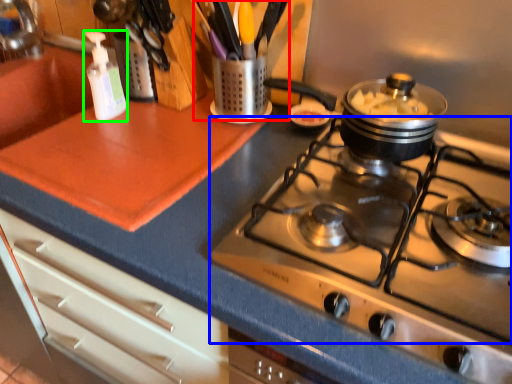
Question: Estimate the real-world distances between objects in this image. Which object is farther from appliance (highlighted by a red box), gas stove (highlighted by a blue box) or bottle (highlighted by a green box)?

Choices:
 (A) gas stove
 (B) bottle

Answer: (A)